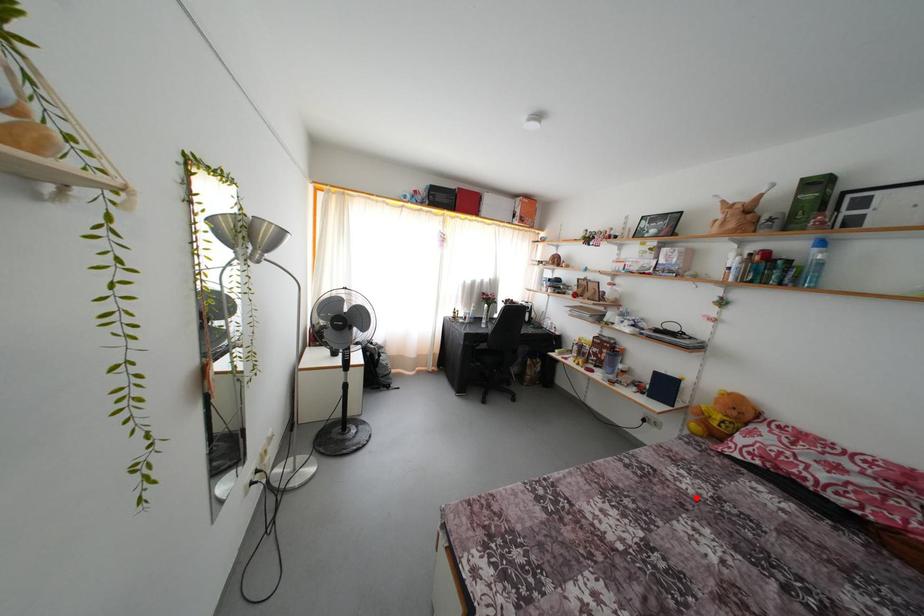
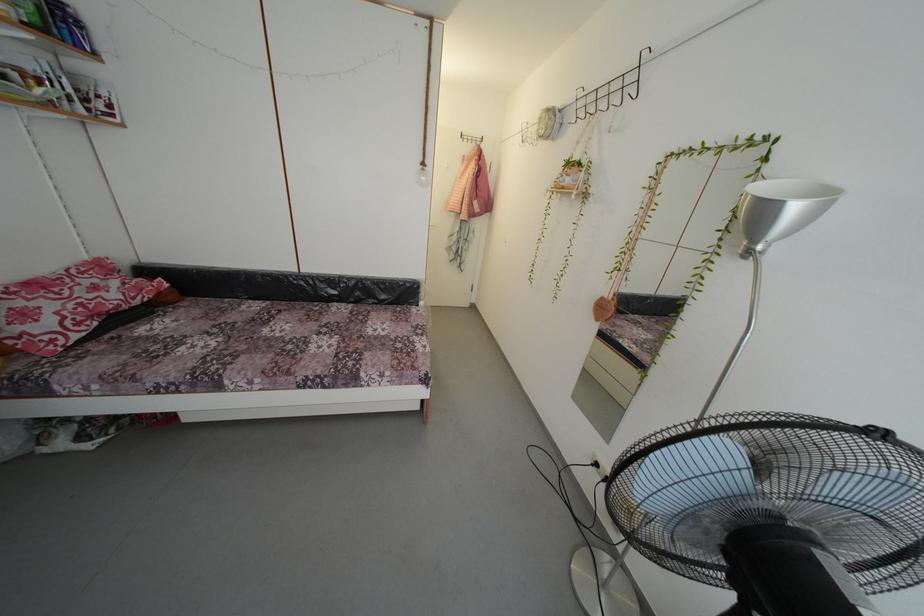
Where in the second image is the point corresponding to the highlighted location from the first image?

(225, 345)